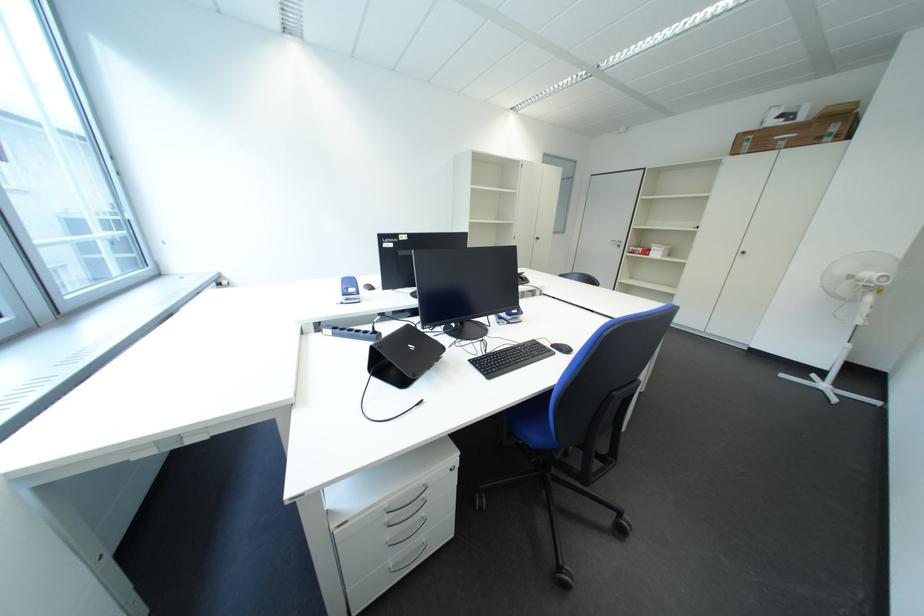
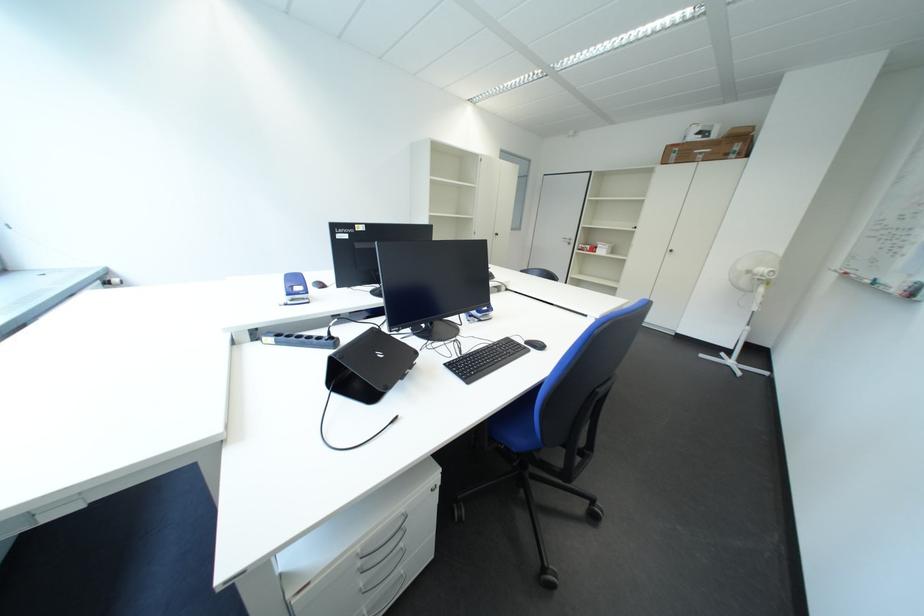
Where in the second image is the point corresponding to (556,350) from the first image?

(531, 347)